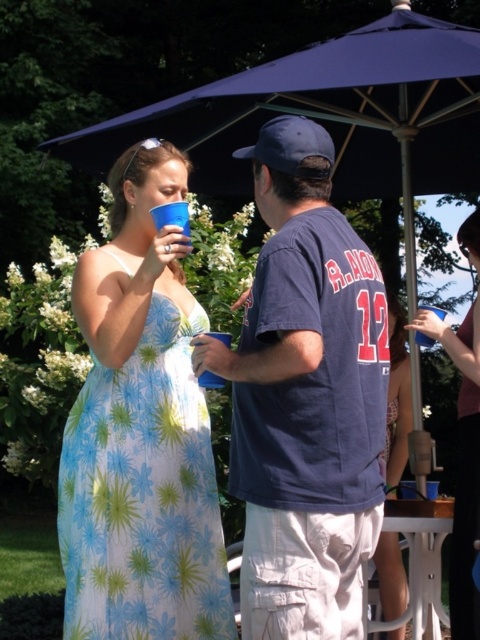
Question: Which object is closer to the camera taking this photo?

Choices:
 (A) matte blue cup at center
 (B) blue plastic cup at center
 (C) blue floral dress at left

Answer: (B)

Question: Which object is closer to the camera taking this photo?

Choices:
 (A) floral fabric dress at center
 (B) blue plastic cup at center
 (C) navy blue t-shirt at center

Answer: (C)

Question: Is blue floral dress at left to the left of navy blue fabric baseball cap at center from the viewer's perspective?

Choices:
 (A) no
 (B) yes

Answer: (B)

Question: Can you confirm if blue floral dress at center is positioned to the right of blue plastic cup at upper left?

Choices:
 (A) yes
 (B) no

Answer: (A)

Question: Does matte blue cup at center appear on the left side of blue floral dress at center?

Choices:
 (A) no
 (B) yes

Answer: (A)

Question: Which of the following is the farthest from the observer?

Choices:
 (A) (476, 268)
 (B) (188, 566)

Answer: (A)